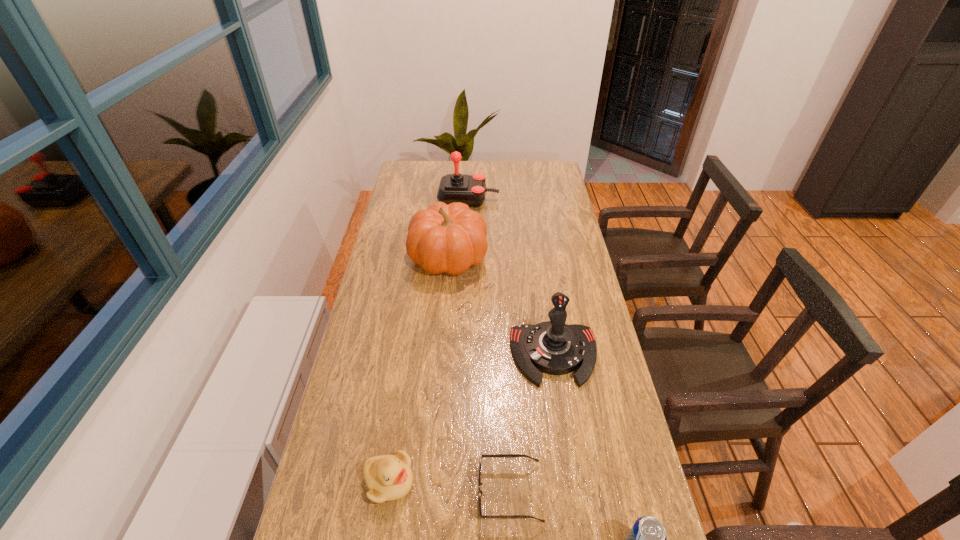
Identify the location of the left joystick. This screenshot has height=540, width=960. click(469, 189).

The image size is (960, 540). In order to click on the farthest object in this screenshot , I will do `click(469, 189)`.

This screenshot has height=540, width=960. I want to click on the fifth nearest object, so click(443, 238).

Where is `the fourth nearest object`? the fourth nearest object is located at coordinates (552, 347).

You are a GUI agent. You are given a task and a screenshot of the screen. Output one action in this format:
    pyautogui.click(x=<x>, y=<y>)
    Task: Click on the nearer joystick
    The height and width of the screenshot is (540, 960).
    Given the screenshot: What is the action you would take?
    tap(552, 347)

Locate an element on the screen. This screenshot has height=540, width=960. the second shortest object is located at coordinates (388, 477).

This screenshot has width=960, height=540. I want to click on the shortest object, so click(x=481, y=455).

In order to click on vacant space located 0.160m on the back of the farther joystick in this screenshot , I will do `click(469, 171)`.

Find the location of a particular element. The image size is (960, 540). free region located on the front of the second farthest object is located at coordinates (445, 295).

You are a GUI agent. You are given a task and a screenshot of the screen. Output one action in this format:
    pyautogui.click(x=<x>, y=<y>)
    Task: Click on the vacant area located 0.160m on the handle side of the fourth nearest object
    Image resolution: width=960 pixels, height=540 pixels.
    Given the screenshot: What is the action you would take?
    pyautogui.click(x=567, y=443)